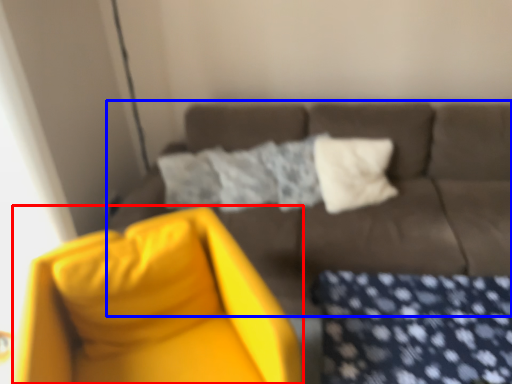
Question: Which object appears closest to the camera in this image, swivel chair (highlighted by a red box) or studio couch (highlighted by a blue box)?

Choices:
 (A) swivel chair
 (B) studio couch

Answer: (A)